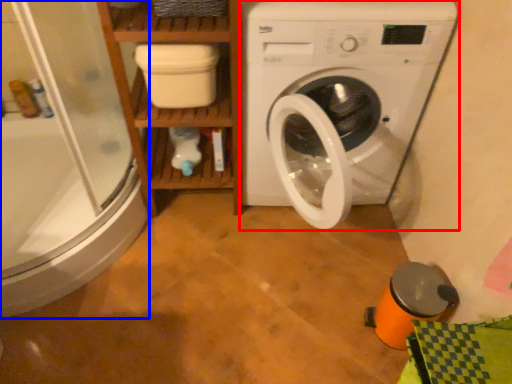
Question: Which object is closer to the camera taking this photo, washing machine (highlighted by a red box) or shower door (highlighted by a blue box)?

Choices:
 (A) washing machine
 (B) shower door

Answer: (B)